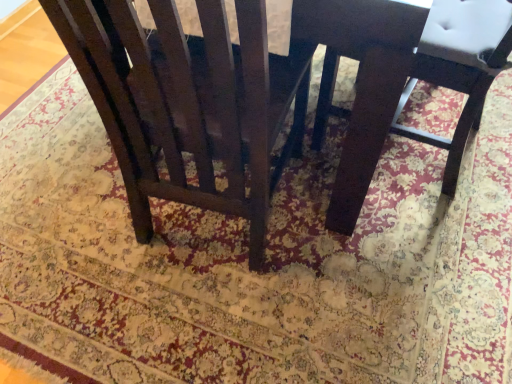
Describe the element at coordinates (364, 82) in the screenshot. I see `dark wood chair at center` at that location.

The height and width of the screenshot is (384, 512). I want to click on matte dark wood chair at center, marked as the first chair in a right-to-left arrangement, so click(x=410, y=92).

This screenshot has width=512, height=384. I want to click on dark wood chair at center, so click(x=364, y=82).

You are a GUI agent. You are given a task and a screenshot of the screen. Output one action in this format:
    pyautogui.click(x=<x>, y=<y>)
    Task: Click on the chair that appears on the left of dark wood chair at center
    Image resolution: width=512 pixels, height=384 pixels.
    Given the screenshot: What is the action you would take?
    pyautogui.click(x=188, y=102)

From the image's perspective, is dark wood chair at center located above or below matte dark wood chair at center, the first chair in the left-to-right sequence?

Clearly, from the image's perspective, dark wood chair at center is above matte dark wood chair at center, the first chair in the left-to-right sequence.

Consider the image. Which of these two, dark wood chair at center or matte dark wood chair at center, the first chair in the left-to-right sequence, is bigger?

dark wood chair at center is bigger.

In the image, is dark wood chair at center positioned in front of or behind matte dark wood chair at center, the first chair in the left-to-right sequence?

In the image, dark wood chair at center appears behind matte dark wood chair at center, the first chair in the left-to-right sequence.

Considering the relative sizes of matte dark wood chair at center, marked as the first chair in a right-to-left arrangement, and matte dark wood chair at center, positioned as the second chair in right-to-left order, in the image provided, is matte dark wood chair at center, marked as the first chair in a right-to-left arrangement, smaller than matte dark wood chair at center, positioned as the second chair in right-to-left order,?

Indeed, matte dark wood chair at center, marked as the first chair in a right-to-left arrangement, has a smaller size compared to matte dark wood chair at center, positioned as the second chair in right-to-left order.

Is matte dark wood chair at center, marked as the 2th chair in a left-to-right arrangement, not close to matte dark wood chair at center, the first chair in the left-to-right sequence?

Actually, matte dark wood chair at center, marked as the 2th chair in a left-to-right arrangement, and matte dark wood chair at center, the first chair in the left-to-right sequence, are a little close together.

Which object is further away from the camera, matte dark wood chair at center, marked as the 2th chair in a left-to-right arrangement, or matte dark wood chair at center, the first chair in the left-to-right sequence?

matte dark wood chair at center, marked as the 2th chair in a left-to-right arrangement, is further away from the camera.

Considering the positions of points (425, 69) and (143, 54), is point (425, 69) farther from camera compared to point (143, 54)?

Yes.

Considering the relative sizes of matte dark wood chair at center, the first chair in the left-to-right sequence, and matte dark wood chair at center, marked as the 2th chair in a left-to-right arrangement, in the image provided, is matte dark wood chair at center, the first chair in the left-to-right sequence, taller than matte dark wood chair at center, marked as the 2th chair in a left-to-right arrangement,?

Correct, matte dark wood chair at center, the first chair in the left-to-right sequence, is much taller as matte dark wood chair at center, marked as the 2th chair in a left-to-right arrangement.

From a real-world perspective, is matte dark wood chair at center, positioned as the second chair in right-to-left order, positioned over matte dark wood chair at center, marked as the 2th chair in a left-to-right arrangement, based on gravity?

Yes, from a real-world perspective, matte dark wood chair at center, positioned as the second chair in right-to-left order, is on top of matte dark wood chair at center, marked as the 2th chair in a left-to-right arrangement.

Based on the photo, considering their positions, is matte dark wood chair at center, the first chair in the left-to-right sequence, located in front of or behind matte dark wood chair at center, marked as the 2th chair in a left-to-right arrangement?

In the image, matte dark wood chair at center, the first chair in the left-to-right sequence, appears in front of matte dark wood chair at center, marked as the 2th chair in a left-to-right arrangement.

I want to click on chair above the matte dark wood chair at center, positioned as the second chair in right-to-left order (from the image's perspective), so click(x=410, y=92).

Between dark wood chair at center and matte dark wood chair at center, marked as the 2th chair in a left-to-right arrangement, which one has less height?

matte dark wood chair at center, marked as the 2th chair in a left-to-right arrangement.

Are dark wood chair at center and matte dark wood chair at center, marked as the first chair in a right-to-left arrangement, making contact?

There is a gap between dark wood chair at center and matte dark wood chair at center, marked as the first chair in a right-to-left arrangement.

Looking at this image, is dark wood chair at center inside the boundaries of matte dark wood chair at center, marked as the 2th chair in a left-to-right arrangement, or outside?

dark wood chair at center is located beyond the bounds of matte dark wood chair at center, marked as the 2th chair in a left-to-right arrangement.

Between matte dark wood chair at center, marked as the first chair in a right-to-left arrangement, and dark wood chair at center, which one has less height?

matte dark wood chair at center, marked as the first chair in a right-to-left arrangement.

From the image's perspective, count 1st chairs downward from the dark wood chair at center and point to it. Please provide its 2D coordinates.

[(410, 92)]

Considering the positions of objects matte dark wood chair at center, marked as the 2th chair in a left-to-right arrangement, and dark wood chair at center in the image provided, who is more to the left, matte dark wood chair at center, marked as the 2th chair in a left-to-right arrangement, or dark wood chair at center?

dark wood chair at center.

Is point (161, 136) behind point (354, 163)?

No, (161, 136) is closer to viewer.

From a real-world perspective, which is physically above, matte dark wood chair at center, positioned as the second chair in right-to-left order, or dark wood chair at center?

matte dark wood chair at center, positioned as the second chair in right-to-left order, from a real-world perspective.

Between matte dark wood chair at center, positioned as the second chair in right-to-left order, and dark wood chair at center, which one appears on the right side from the viewer's perspective?

Positioned to the right is dark wood chair at center.

Is matte dark wood chair at center, the first chair in the left-to-right sequence, aimed at dark wood chair at center?

Yes, matte dark wood chair at center, the first chair in the left-to-right sequence, is turned towards dark wood chair at center.

Identify the location of round table above the matte dark wood chair at center, the first chair in the left-to-right sequence (from the image's perspective). (364, 82).

What are the coordinates of `chair below the matte dark wood chair at center, the first chair in the left-to-right sequence (from a real-world perspective)` in the screenshot? It's located at (410, 92).

Based on their spatial positions, is dark wood chair at center or matte dark wood chair at center, positioned as the second chair in right-to-left order, closer to matte dark wood chair at center, marked as the first chair in a right-to-left arrangement?

dark wood chair at center lies closer to matte dark wood chair at center, marked as the first chair in a right-to-left arrangement, than the other object.

Looking at the image, which one is located further to matte dark wood chair at center, the first chair in the left-to-right sequence, matte dark wood chair at center, marked as the 2th chair in a left-to-right arrangement, or dark wood chair at center?

The object further to matte dark wood chair at center, the first chair in the left-to-right sequence, is matte dark wood chair at center, marked as the 2th chair in a left-to-right arrangement.

Estimate the real-world distances between objects in this image. Which object is closer to dark wood chair at center, matte dark wood chair at center, marked as the first chair in a right-to-left arrangement, or matte dark wood chair at center, positioned as the second chair in right-to-left order?

The object closer to dark wood chair at center is matte dark wood chair at center, marked as the first chair in a right-to-left arrangement.

From the image, which object appears to be nearer to matte dark wood chair at center, the first chair in the left-to-right sequence, dark wood chair at center or matte dark wood chair at center, marked as the 2th chair in a left-to-right arrangement?

dark wood chair at center lies closer to matte dark wood chair at center, the first chair in the left-to-right sequence, than the other object.

Looking at the image, which one is located closer to dark wood chair at center, matte dark wood chair at center, the first chair in the left-to-right sequence, or matte dark wood chair at center, marked as the 2th chair in a left-to-right arrangement?

The object closer to dark wood chair at center is matte dark wood chair at center, marked as the 2th chair in a left-to-right arrangement.

From the image, which object appears to be nearer to matte dark wood chair at center, marked as the 2th chair in a left-to-right arrangement, matte dark wood chair at center, the first chair in the left-to-right sequence, or dark wood chair at center?

Based on the image, dark wood chair at center appears to be nearer to matte dark wood chair at center, marked as the 2th chair in a left-to-right arrangement.

Identify the location of round table between matte dark wood chair at center, positioned as the second chair in right-to-left order, and matte dark wood chair at center, marked as the first chair in a right-to-left arrangement. Image resolution: width=512 pixels, height=384 pixels. (364, 82).